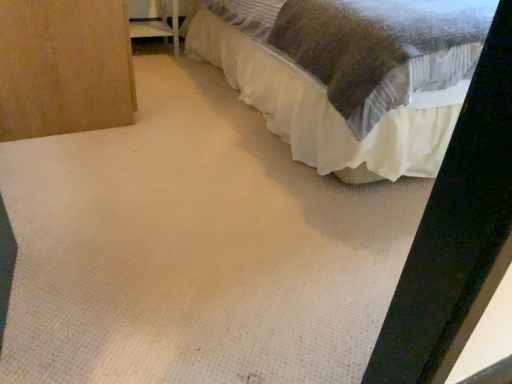
What do you see at coordinates (158, 25) in the screenshot?
I see `white plastic shelf at upper left` at bounding box center [158, 25].

I want to click on white plastic shelf at upper left, so click(x=158, y=25).

What is the approximate height of white textured bed at upper right?

white textured bed at upper right is 28.05 inches in height.

This screenshot has height=384, width=512. What do you see at coordinates (350, 74) in the screenshot?
I see `white textured bed at upper right` at bounding box center [350, 74].

Image resolution: width=512 pixels, height=384 pixels. What are the coordinates of `white textured bed at upper right` in the screenshot? It's located at (350, 74).

At what (x,y) coordinates should I click in order to perform the action: click on white plastic shelf at upper left. Please return your answer as a coordinate pair (x, y). Looking at the image, I should click on (x=158, y=25).

Considering the positions of objects white plastic shelf at upper left and white textured bed at upper right in the image provided, who is more to the left, white plastic shelf at upper left or white textured bed at upper right?

white plastic shelf at upper left.

Does white plastic shelf at upper left come in front of white textured bed at upper right?

No, white plastic shelf at upper left is further to the viewer.

Is point (165, 10) more distant than point (359, 60)?

Yes, point (165, 10) is farther from viewer.

From the image's perspective, would you say white plastic shelf at upper left is positioned over white textured bed at upper right?

Yes, from the image's perspective, white plastic shelf at upper left is over white textured bed at upper right.

From a real-world perspective, between white plastic shelf at upper left and white textured bed at upper right, who is vertically lower?

white plastic shelf at upper left, from a real-world perspective.

In the scene shown: Considering the sizes of objects white plastic shelf at upper left and white textured bed at upper right in the image provided, who is thinner, white plastic shelf at upper left or white textured bed at upper right?

With smaller width is white plastic shelf at upper left.

Does white plastic shelf at upper left have a greater height compared to white textured bed at upper right?

No.

Considering the relative sizes of white plastic shelf at upper left and white textured bed at upper right in the image provided, is white plastic shelf at upper left bigger than white textured bed at upper right?

No.

Is white textured bed at upper right a part of white plastic shelf at upper left?

No.

Is white plastic shelf at upper left not near white textured bed at upper right?

Yes, white plastic shelf at upper left and white textured bed at upper right are quite far apart.

Is white plastic shelf at upper left facing away from white textured bed at upper right?

No.

How distant is white plastic shelf at upper left from white textured bed at upper right?

They are 3.62 feet apart.

I want to click on bed below the white plastic shelf at upper left (from the image's perspective), so click(350, 74).

Is white textured bed at upper right to the left of white plastic shelf at upper left from the viewer's perspective?

Incorrect, white textured bed at upper right is not on the left side of white plastic shelf at upper left.

Which object is further away from the camera taking this photo, white textured bed at upper right or white plastic shelf at upper left?

white plastic shelf at upper left is behind.

Considering the positions of point (419, 44) and point (129, 21), is point (419, 44) closer or farther from the camera than point (129, 21)?

Point (419, 44) appears to be closer to the viewer than point (129, 21).

From the image's perspective, between white textured bed at upper right and white plastic shelf at upper left, who is located below?

From the image's view, white textured bed at upper right is below.

From a real-world perspective, does white textured bed at upper right stand above white plastic shelf at upper left?

Yes, from a real-world perspective, white textured bed at upper right is over white plastic shelf at upper left

Does white textured bed at upper right have a greater width compared to white plastic shelf at upper left?

Correct, the width of white textured bed at upper right exceeds that of white plastic shelf at upper left.

Considering the sizes of objects white textured bed at upper right and white plastic shelf at upper left in the image provided, who is taller, white textured bed at upper right or white plastic shelf at upper left?

With more height is white textured bed at upper right.

Is white textured bed at upper right bigger than white plastic shelf at upper left?

Correct, white textured bed at upper right is larger in size than white plastic shelf at upper left.

Would you say white textured bed at upper right contains white plastic shelf at upper left?

Definitely not — white plastic shelf at upper left is not inside white textured bed at upper right.

Is white textured bed at upper right not close to white plastic shelf at upper left?

white textured bed at upper right is far away from white plastic shelf at upper left.

Is white textured bed at upper right facing away from white plastic shelf at upper left?

That's not correct — white textured bed at upper right is not looking away from white plastic shelf at upper left.

In the scene shown: Can you tell me how much white textured bed at upper right and white plastic shelf at upper left differ in facing direction?

The facing directions of white textured bed at upper right and white plastic shelf at upper left are 0.116 degrees apart.

Identify the location of furniture on the left of the white textured bed at upper right. The height and width of the screenshot is (384, 512). (158, 25).

This screenshot has width=512, height=384. I want to click on bed in front of the white plastic shelf at upper left, so click(350, 74).

What are the coordinates of `bed below the white plastic shelf at upper left (from the image's perspective)` in the screenshot? It's located at (350, 74).